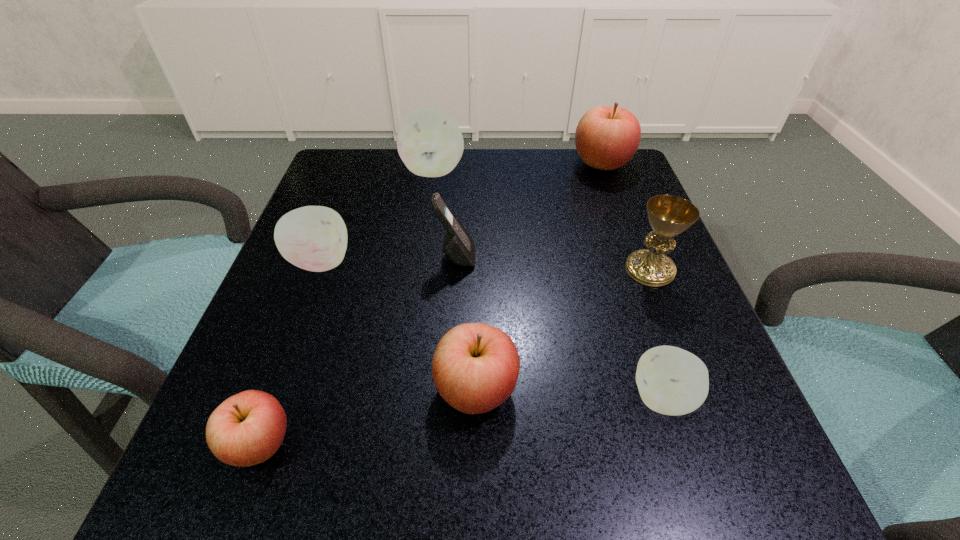
At what (x,y) coordinates should I click in order to perform the action: click on the biggest white apple. Please return your answer as a coordinate pair (x, y). Looking at the image, I should click on (429, 142).

The image size is (960, 540). Find the location of `the farthest white apple`. the farthest white apple is located at coordinates (429, 142).

Find the location of a particular element. The image size is (960, 540). the biggest red apple is located at coordinates (606, 138).

This screenshot has height=540, width=960. What are the coordinates of `the rightmost red apple` in the screenshot? It's located at (606, 138).

The height and width of the screenshot is (540, 960). What are the coordinates of `chalice` in the screenshot? It's located at (668, 215).

The height and width of the screenshot is (540, 960). In order to click on cellular telephone in this screenshot , I will do `click(459, 247)`.

Find the location of `the second farthest white apple`. the second farthest white apple is located at coordinates (314, 238).

You are a GUI agent. You are given a task and a screenshot of the screen. Output one action in this format:
    pyautogui.click(x=<x>, y=<y>)
    Task: Click on the leftmost white apple
    This screenshot has height=540, width=960.
    Given the screenshot: What is the action you would take?
    pyautogui.click(x=314, y=238)

Find the location of a particular element. The image size is (960, 540). the second red apple from right to left is located at coordinates (475, 367).

This screenshot has width=960, height=540. Identify the location of the nearest white apple. (672, 381).